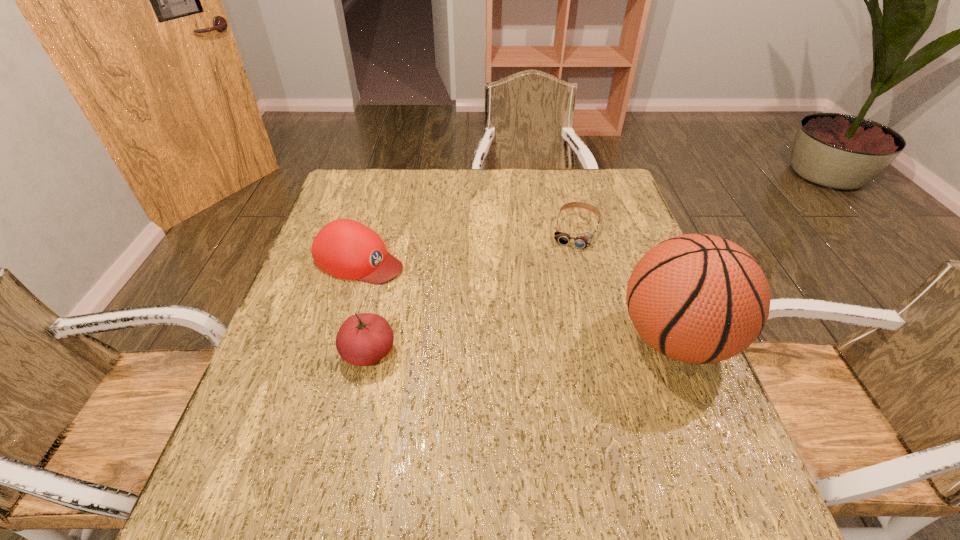
This screenshot has width=960, height=540. In the image, there is a desktop. What are the coordinates of `vacant space at the near right corner` in the screenshot? It's located at tap(678, 437).

Locate an element on the screen. The image size is (960, 540). vacant space that is in between the baseball cap and the basketball is located at coordinates (517, 299).

You are a GUI agent. You are given a task and a screenshot of the screen. Output one action in this format:
    pyautogui.click(x=<x>, y=<y>)
    Task: Click on the free space between the tomato and the basketball
    The width and height of the screenshot is (960, 540).
    Given the screenshot: What is the action you would take?
    pyautogui.click(x=522, y=346)

Where is `empty space that is in between the tomato and the basketball`? This screenshot has height=540, width=960. empty space that is in between the tomato and the basketball is located at coordinates (522, 346).

You are a GUI agent. You are given a task and a screenshot of the screen. Output one action in this format:
    pyautogui.click(x=<x>, y=<y>)
    Task: Click on the vacant area between the baseball cap and the shortest object
    The height and width of the screenshot is (540, 960).
    Given the screenshot: What is the action you would take?
    (468, 245)

Find the location of a particular element. The height and width of the screenshot is (540, 960). empty space between the shortest object and the baseball cap is located at coordinates 468,245.

Locate an element on the screen. free space between the baseball cap and the shortest object is located at coordinates (468, 245).

At what (x,y) coordinates should I click in order to perform the action: click on free space between the tallest object and the tomato. Please return your answer as a coordinate pair (x, y). This screenshot has height=540, width=960. Looking at the image, I should click on (522, 346).

Image resolution: width=960 pixels, height=540 pixels. In order to click on vacant space that's between the goggles and the tallest object in this screenshot , I will do `click(625, 285)`.

Identify the location of free space between the shortest object and the tomato. (472, 292).